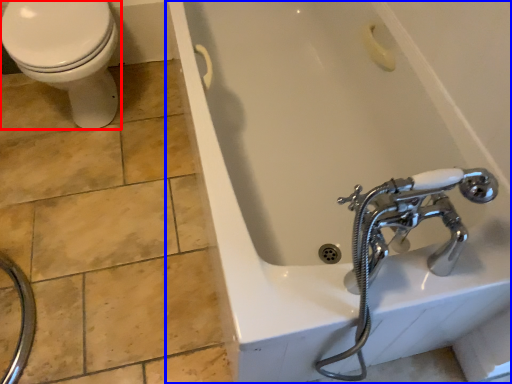
Question: Which object is closer to the camera taking this photo, bidet (highlighted by a red box) or bathtub (highlighted by a blue box)?

Choices:
 (A) bidet
 (B) bathtub

Answer: (B)